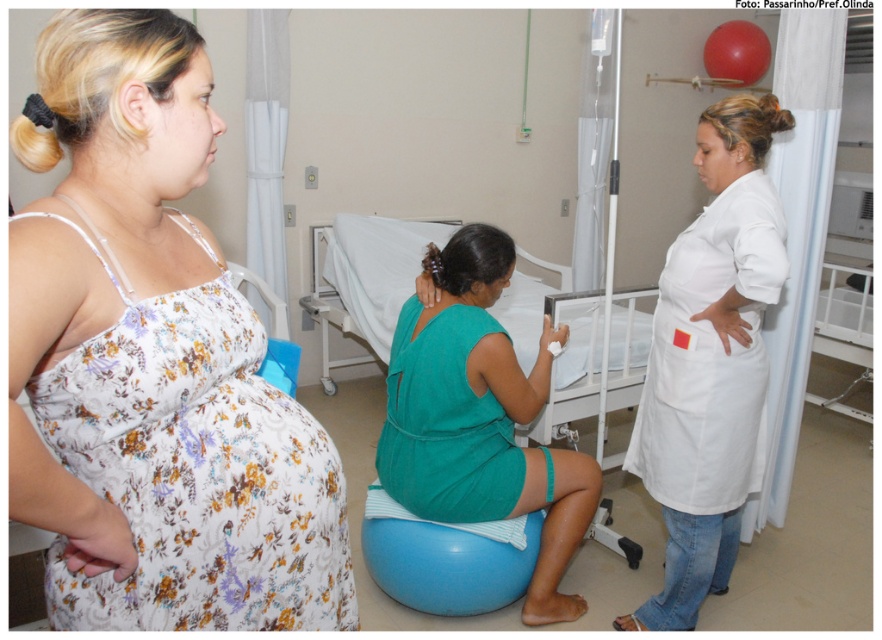
Question: Is floral fabric dress at center in front of white smooth lab coat at center?

Choices:
 (A) yes
 (B) no

Answer: (A)

Question: Does white smooth lab coat at center have a smaller size compared to white fabric hospital bed at center?

Choices:
 (A) no
 (B) yes

Answer: (B)

Question: Does floral fabric dress at center appear on the left side of white fabric hospital bed at center?

Choices:
 (A) no
 (B) yes

Answer: (B)

Question: Which of these objects is positioned farthest from the floral fabric dress at center?

Choices:
 (A) white fabric hospital bed at center
 (B) white smooth lab coat at center

Answer: (A)

Question: Which point appears farthest from the camera in this image?

Choices:
 (A) (451, 224)
 (B) (696, 307)
 (C) (213, 333)

Answer: (A)

Question: Considering the real-world distances, which object is closest to the white fabric hospital bed at center?

Choices:
 (A) floral fabric dress at center
 (B) white smooth lab coat at center

Answer: (B)